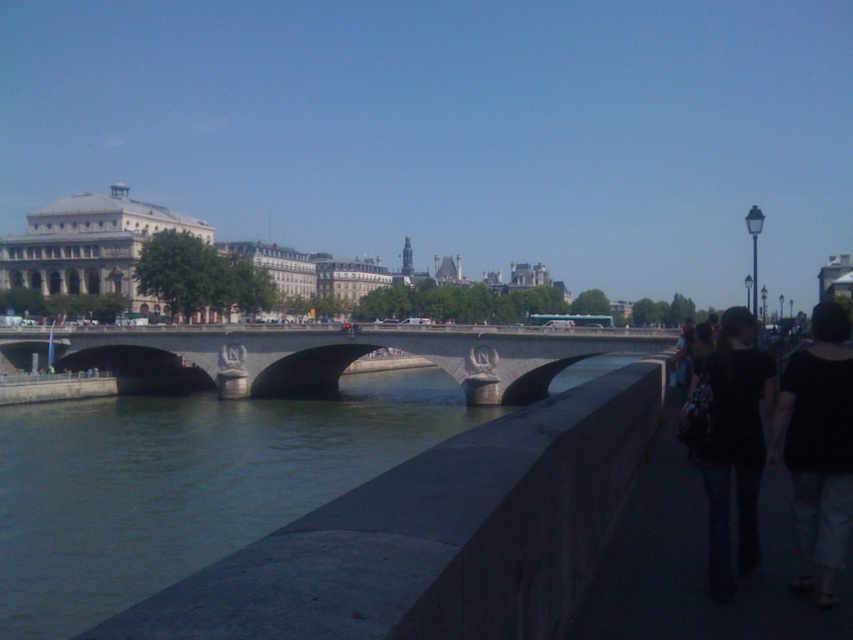
Can you confirm if concrete bridge at center is smaller than black fabric backpack at lower right?

No.

Consider the image. Who is more forward, (225,330) or (738,436)?

Positioned in front is point (738,436).

Between point (358, 355) and point (685, 413), which one is positioned in front?

Point (685, 413) is in front.

Find the location of `concrete bridge at center`. concrete bridge at center is located at coordinates (x=328, y=358).

Looking at this image, can you confirm if dark gray concrete sidewalk at lower right is bigger than black fabric at lower right?

Incorrect, dark gray concrete sidewalk at lower right is not larger than black fabric at lower right.

Can you confirm if dark gray concrete sidewalk at lower right is taller than black fabric at lower right?

No, dark gray concrete sidewalk at lower right is not taller than black fabric at lower right.

Measure the distance between dark gray concrete sidewalk at lower right and camera.

dark gray concrete sidewalk at lower right is 18.44 meters away from camera.

You are a GUI agent. You are given a task and a screenshot of the screen. Output one action in this format:
    pyautogui.click(x=<x>, y=<y>)
    Task: Click on the dark gray concrete sidewalk at lower right
    This screenshot has height=640, width=853.
    Given the screenshot: What is the action you would take?
    pyautogui.click(x=699, y=564)

Between point (543, 396) and point (816, 378), which one is positioned behind?

Positioned behind is point (543, 396).

Can you confirm if concrete bridge at center is taller than black fabric at lower right?

Indeed, concrete bridge at center has a greater height compared to black fabric at lower right.

The image size is (853, 640). What do you see at coordinates (328, 358) in the screenshot? I see `concrete bridge at center` at bounding box center [328, 358].

Where is `concrete bridge at center`? This screenshot has width=853, height=640. concrete bridge at center is located at coordinates (328, 358).